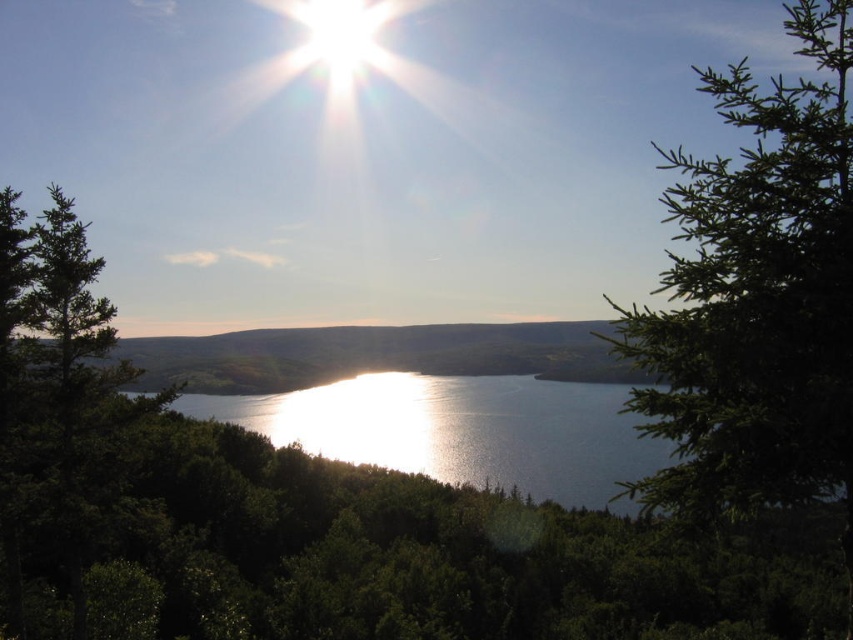
Between green needle-like tree at right and shiny reflective water at center, which one appears on the left side from the viewer's perspective?

shiny reflective water at center

Is green needle-like tree at right bigger than shiny reflective water at center?

Correct, green needle-like tree at right is larger in size than shiny reflective water at center.

Who is more forward, (844, 88) or (630, 413)?

Point (844, 88) is in front.

Image resolution: width=853 pixels, height=640 pixels. Identify the location of green needle-like tree at right. (758, 296).